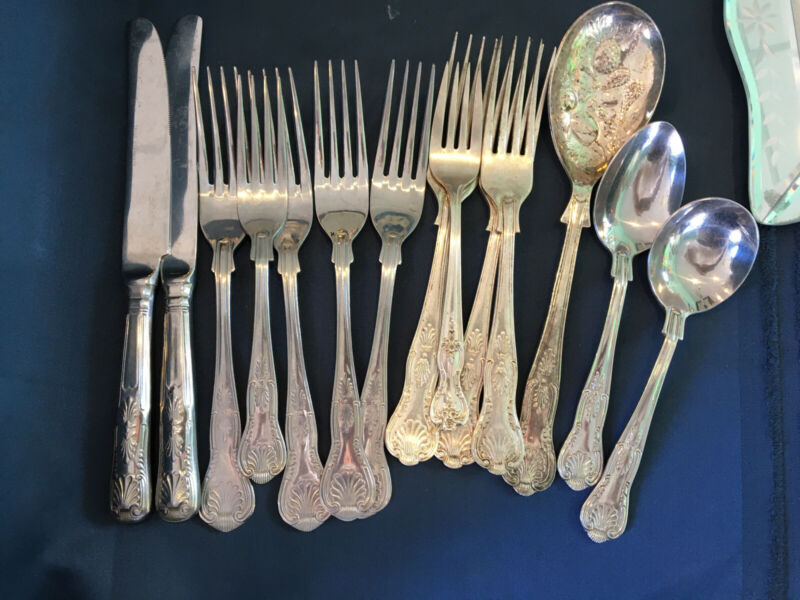
Identify the location of forks. (228, 289), (252, 298), (289, 319), (340, 321), (374, 334), (414, 345), (446, 346), (476, 337), (498, 340).